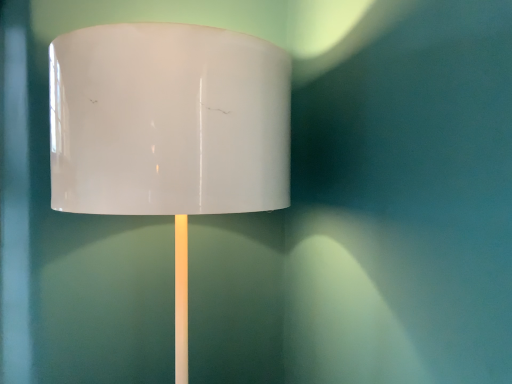
What do you see at coordinates (169, 130) in the screenshot? I see `matte white lampshade at center` at bounding box center [169, 130].

What is the approximate height of matte white lampshade at center?

The height of matte white lampshade at center is 33.89 inches.

You are a GUI agent. You are given a task and a screenshot of the screen. Output one action in this format:
    pyautogui.click(x=<x>, y=<y>)
    Task: Click on the matte white lampshade at center
    
    Given the screenshot: What is the action you would take?
    pyautogui.click(x=169, y=130)

This screenshot has width=512, height=384. Find the location of `matte white lampshade at center`. matte white lampshade at center is located at coordinates (169, 130).